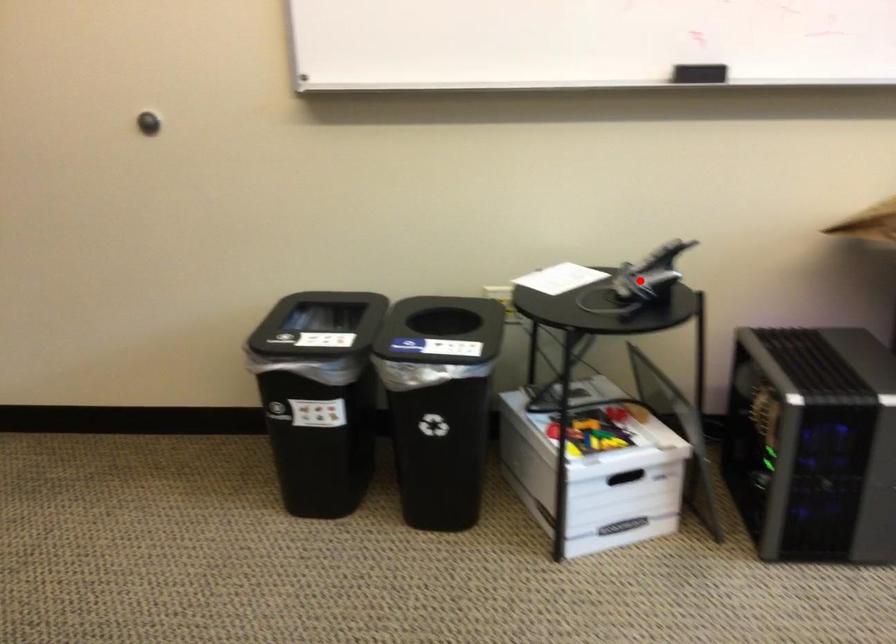
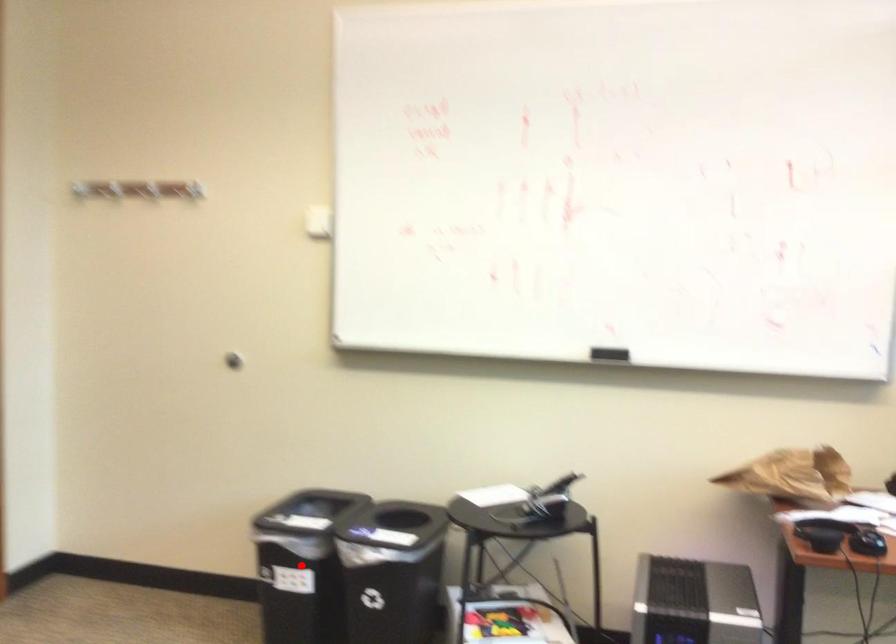
I am providing you with two images of the same scene from different viewpoints. A red point is marked on the first image and another point is marked on the second image. Do the highlighted points in image1 and image2 indicate the same real-world spot?

No